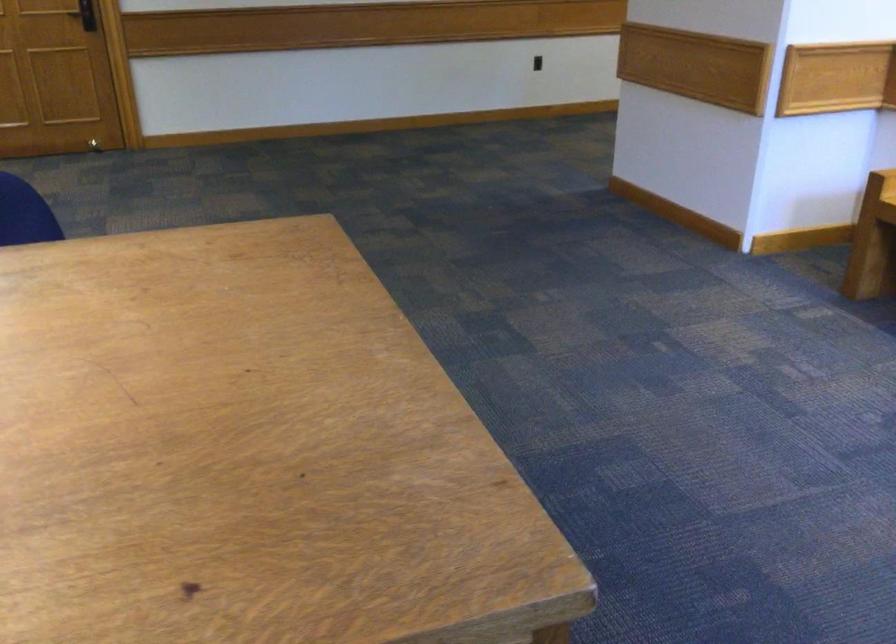
How did the camera likely rotate?

The rotation direction of the camera is right-down.